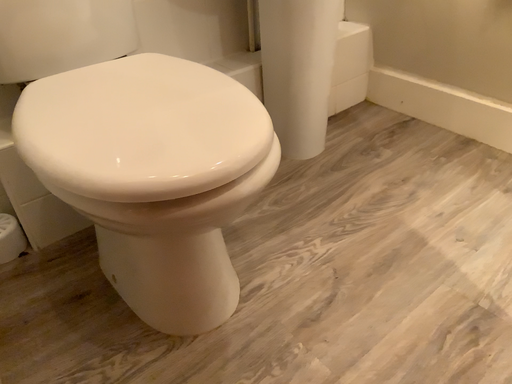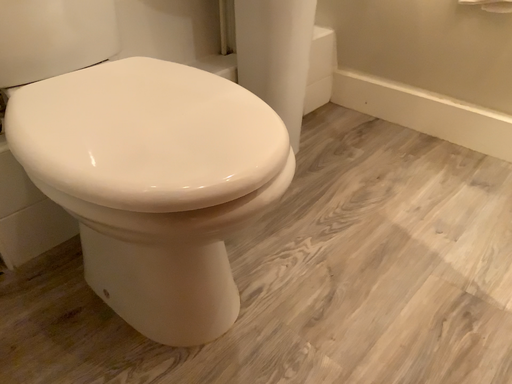
Question: Which way did the camera rotate in the video?

Choices:
 (A) rotated right
 (B) rotated left

Answer: (A)